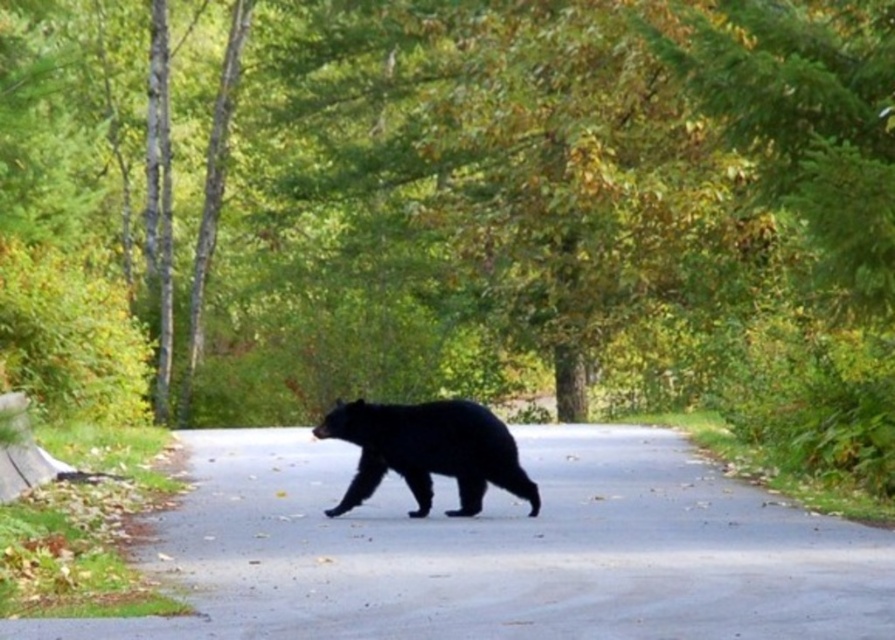
Based on the photo, can you confirm if black asphalt road at center is smaller than black fur bear at center?

Incorrect, black asphalt road at center is not smaller in size than black fur bear at center.

This screenshot has width=895, height=640. What are the coordinates of `black asphalt road at center` in the screenshot? It's located at (499, 550).

This screenshot has height=640, width=895. I want to click on black asphalt road at center, so click(499, 550).